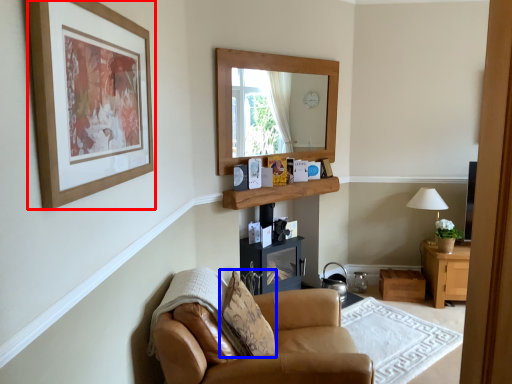
Question: Among these objects, which one is farthest to the camera, picture frame (highlighted by a red box) or pillow (highlighted by a blue box)?

Choices:
 (A) picture frame
 (B) pillow

Answer: (B)